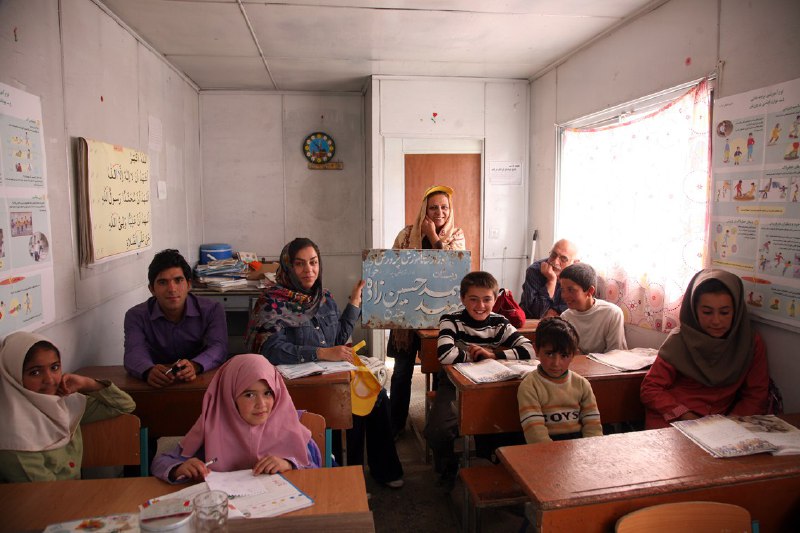
Identify the location of posters. (18, 220), (768, 204).